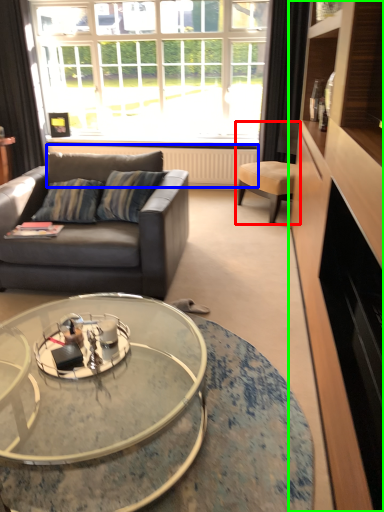
Question: Which object is positioned closest to chair (highlighted by a red box)? Select from radiator (highlighted by a blue box) and cabinetry (highlighted by a green box).

Choices:
 (A) radiator
 (B) cabinetry

Answer: (A)